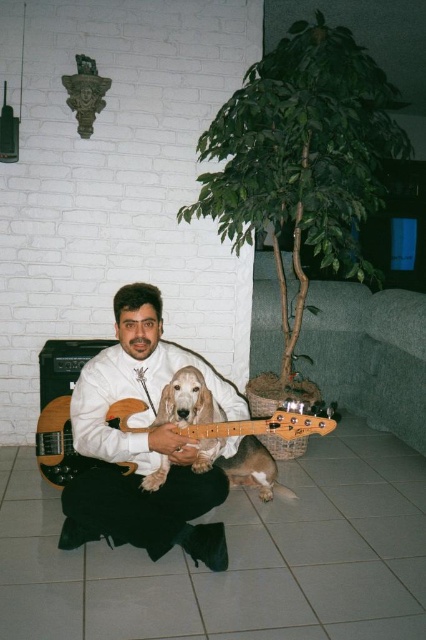
Consider the image. Who is positioned more to the right, white matte shirt at center or wooden electric guitar at lower left?

From the viewer's perspective, white matte shirt at center appears more on the right side.

Does white matte shirt at center have a greater height compared to wooden electric guitar at lower left?

Yes.

Who is more distant from viewer, (91, 493) or (121, 404)?

The point (121, 404) is more distant.

What are the coordinates of `white matte shirt at center` in the screenshot? It's located at (141, 444).

Can you confirm if green leafy tree at center is bigger than wooden electric guitar at center?

Yes, green leafy tree at center is bigger than wooden electric guitar at center.

Can you confirm if green leafy tree at center is shorter than wooden electric guitar at center?

No.

You are a GUI agent. You are given a task and a screenshot of the screen. Output one action in this format:
    pyautogui.click(x=<x>, y=<y>)
    Task: Click on the green leafy tree at center
    
    Given the screenshot: What is the action you would take?
    pyautogui.click(x=302, y=157)

Is green leafy tree at center bigger than white matte shirt at center?

Yes, green leafy tree at center is bigger than white matte shirt at center.

Is green leafy tree at center above white matte shirt at center?

Correct, green leafy tree at center is located above white matte shirt at center.

The width and height of the screenshot is (426, 640). I want to click on green leafy tree at center, so click(x=302, y=157).

Find the location of a particular element. The image size is (426, 640). green leafy tree at center is located at coordinates (302, 157).